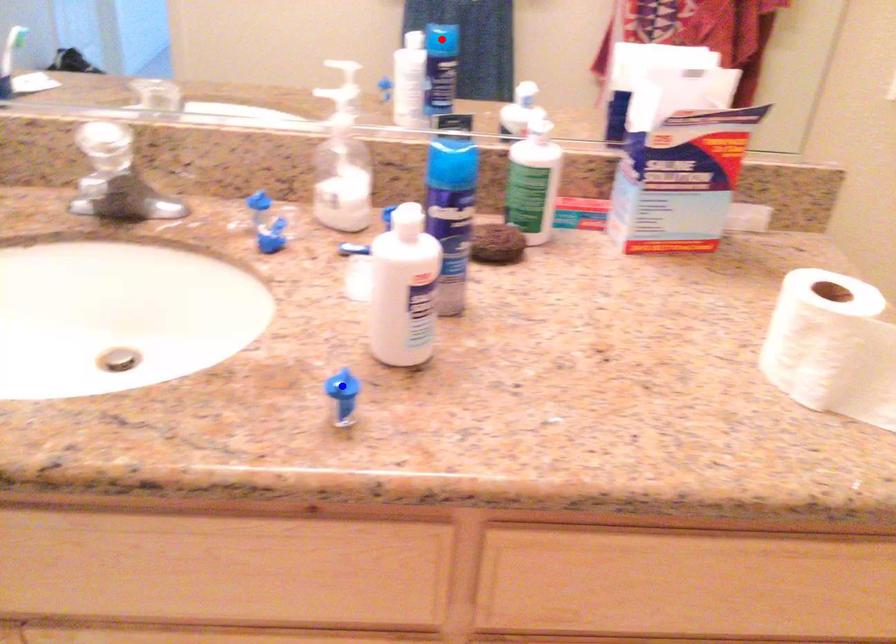
Question: Which of the two points in the image is closer to the camera?

Choices:
 (A) Blue point is closer.
 (B) Red point is closer.

Answer: (A)